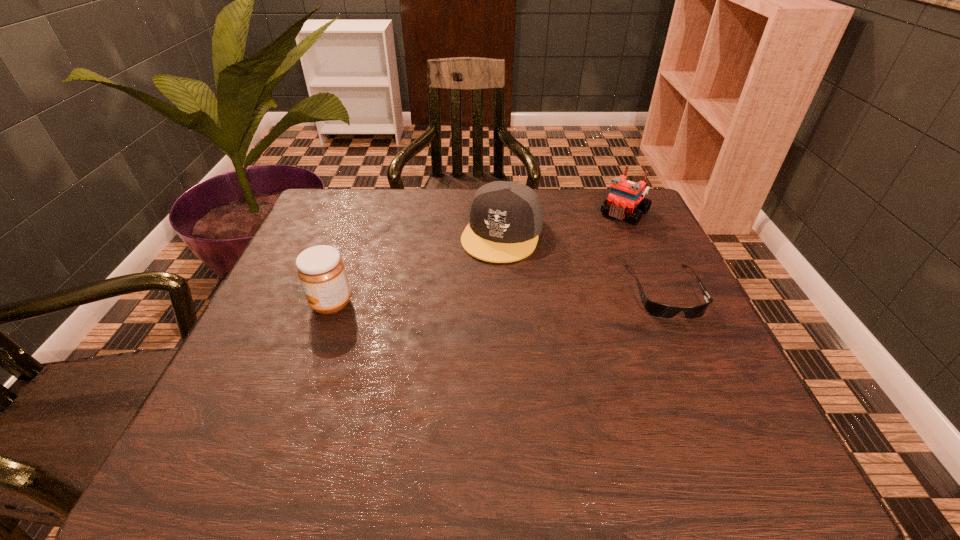
The image size is (960, 540). Identify the location of vacant space at the right edge. 643,323.

Where is `vacant space at the far left corner of the desktop`? This screenshot has width=960, height=540. vacant space at the far left corner of the desktop is located at coordinates (372, 206).

The height and width of the screenshot is (540, 960). What are the coordinates of `vacant space at the near right corner` in the screenshot? It's located at (681, 389).

The height and width of the screenshot is (540, 960). I want to click on free space between the Lego and the cap, so click(x=564, y=223).

Identify the location of free spot between the shortest object and the third object from right to left. (584, 262).

Where is `vacant area that lies between the jam and the sunglasses`? The height and width of the screenshot is (540, 960). vacant area that lies between the jam and the sunglasses is located at coordinates (498, 298).

You are a GUI agent. You are given a task and a screenshot of the screen. Output one action in this format:
    pyautogui.click(x=<x>, y=<y>)
    Task: Click on the free spot between the jam and the third object from right to left
    
    Given the screenshot: What is the action you would take?
    pyautogui.click(x=417, y=268)

I want to click on free space that is in between the jam and the shortest object, so click(498, 298).

Find the location of a particular element. The width and height of the screenshot is (960, 540). free spot between the sunglasses and the Lego is located at coordinates (645, 252).

What are the coordinates of `vacant space that is in between the jam and the shortest object` in the screenshot? It's located at (498, 298).